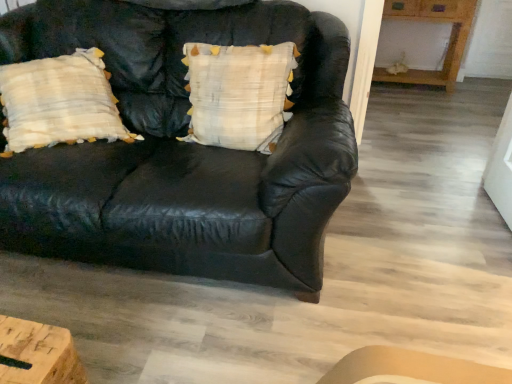
Question: Based on their sizes in the image, would you say black leather couch at center is bigger or smaller than white textured pillow at center?

Choices:
 (A) big
 (B) small

Answer: (A)

Question: Is black leather couch at center wider or thinner than white textured pillow at center?

Choices:
 (A) thin
 (B) wide

Answer: (B)

Question: Which is nearer to the black leather couch at center?

Choices:
 (A) white textured pillow at center
 (B) wooden table at upper right

Answer: (A)

Question: Estimate the real-world distances between objects in this image. Which object is farther from the white textured pillow at center?

Choices:
 (A) black leather couch at center
 (B) wooden table at upper right

Answer: (B)